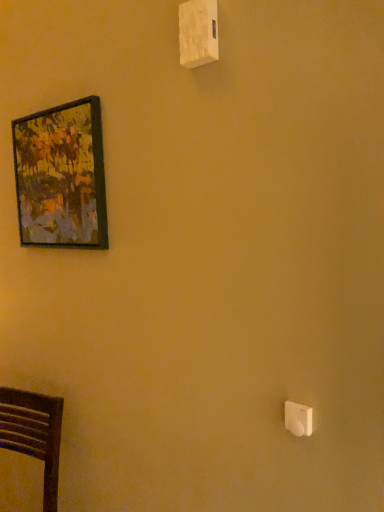
Question: Visually, is wooden-framed painting at upper left positioned to the left or to the right of dark wood chair at lower left?

Choices:
 (A) left
 (B) right

Answer: (B)

Question: Relative to dark wood chair at lower left, is wooden-framed painting at upper left in front or behind?

Choices:
 (A) front
 (B) behind

Answer: (B)

Question: Which object is the farthest from the white plastic light switch at lower right, arranged as the first light switch when ordered from the bottom?

Choices:
 (A) dark wood chair at lower left
 (B) white plastic light switch at upper center, placed as the second light switch when sorted from front to back
 (C) wooden-framed painting at upper left

Answer: (C)

Question: Estimate the real-world distances between objects in this image. Which object is farther from the wooden-framed painting at upper left?

Choices:
 (A) white plastic light switch at upper center, which is the 1th light switch in back-to-front order
 (B) white plastic light switch at lower right, the 1th light switch from the right
 (C) dark wood chair at lower left

Answer: (B)